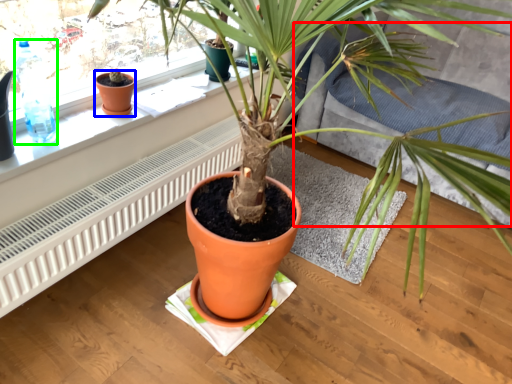
Question: Estimate the real-world distances between objects in this image. Which object is closer to couch (highlighted by a red box), flowerpot (highlighted by a blue box) or bottle (highlighted by a green box)?

Choices:
 (A) flowerpot
 (B) bottle

Answer: (A)